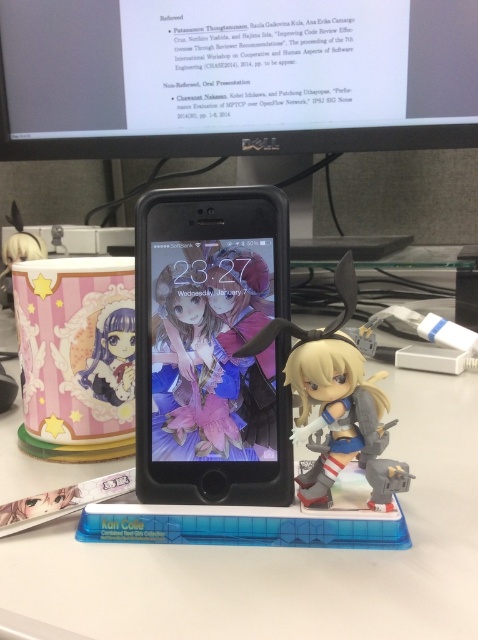
Who is higher up, black matte computer monitor at upper center or matte plastic figurine at left?

black matte computer monitor at upper center is higher up.

Who is positioned more to the right, black matte computer monitor at upper center or matte plastic figurine at left?

From the viewer's perspective, black matte computer monitor at upper center appears more on the right side.

Measure the distance between point (52, 8) and camera.

The distance of point (52, 8) from camera is 36.39 inches.

I want to click on black matte computer monitor at upper center, so click(x=235, y=76).

Is black matte computer monitor at upper center to the left of black matte phone at center from the viewer's perspective?

Yes, black matte computer monitor at upper center is to the left of black matte phone at center.

Is point (140, 16) in front of point (260, 360)?

No, (140, 16) is further to viewer.

At what (x,y) coordinates should I click in order to perform the action: click on black matte computer monitor at upper center. Please return your answer as a coordinate pair (x, y). Looking at the image, I should click on (235, 76).

Who is taller, black matte phone at center or matte plastic figurine at left?

black matte phone at center

Who is more distant from viewer, (138, 237) or (130, 324)?

The point (130, 324) is more distant.

The height and width of the screenshot is (640, 478). In order to click on black matte phone at center in this screenshot , I will do `click(210, 346)`.